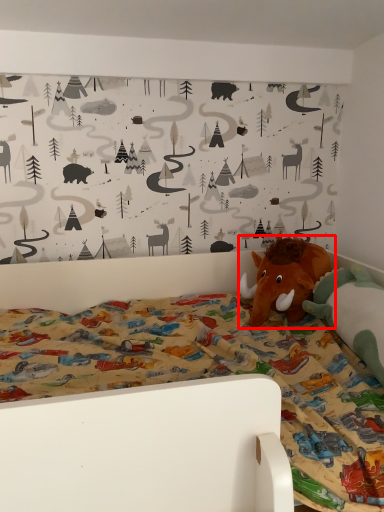
Question: From the image, what is the correct spatial relationship of toy (annotated by the red box) in relation to toy?

Choices:
 (A) left
 (B) right

Answer: (A)